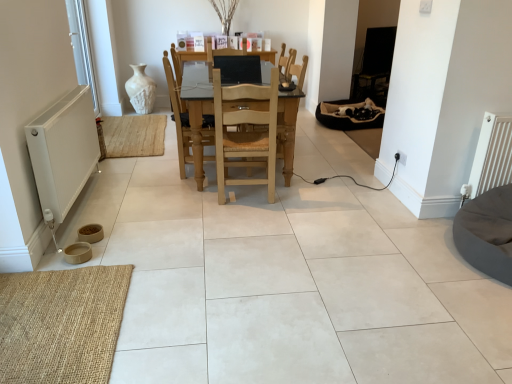
Locate an element on the screen. vacant area that lies between dark gray fabric bean bag at lower right, which appears as the 2th bean bag chair when viewed from the top, and white matte radiator at lower left is located at coordinates coord(280,231).